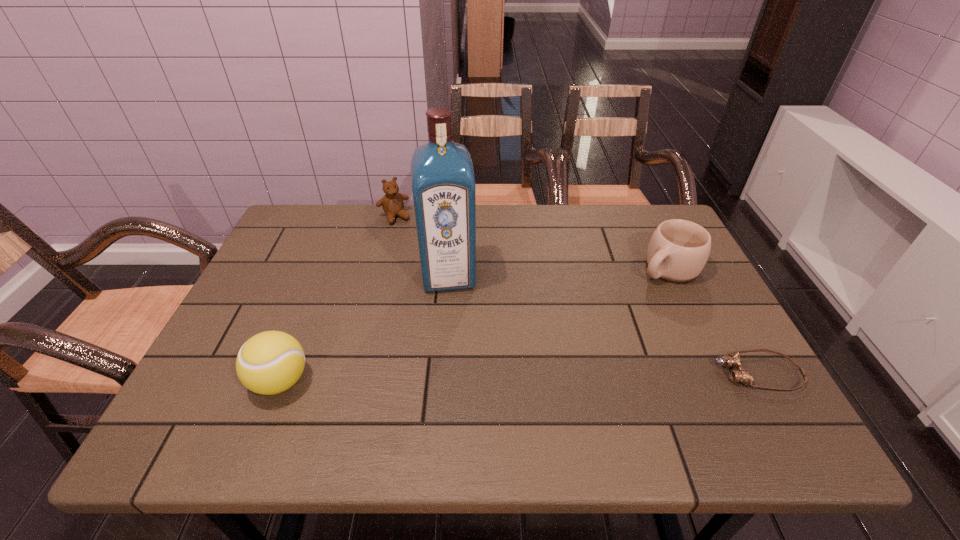
Find the location of a particular element. The height and width of the screenshot is (540, 960). free space at the far edge is located at coordinates (481, 208).

Where is `vacant space at the near edge of the desktop`? vacant space at the near edge of the desktop is located at coordinates (319, 381).

At what (x,y) coordinates should I click in order to perform the action: click on vacant area at the left edge. Please return your answer as a coordinate pair (x, y). Looking at the image, I should click on (280, 307).

Where is `free space at the right edge of the desktop`? free space at the right edge of the desktop is located at coordinates (692, 335).

The height and width of the screenshot is (540, 960). Find the location of `blank space at the far right corner of the desktop`. blank space at the far right corner of the desktop is located at coordinates (636, 249).

Locate an element on the screen. This screenshot has height=540, width=960. free space between the mug and the tennis ball is located at coordinates (474, 325).

Locate an element on the screen. The height and width of the screenshot is (540, 960). vacant region between the leftmost object and the teddy bear is located at coordinates [x=337, y=299].

Locate an element on the screen. free space between the third object from right to left and the leftmost object is located at coordinates click(365, 328).

In order to click on free area in between the mug and the tennis ball in this screenshot , I will do `click(474, 325)`.

You are a GUI agent. You are given a task and a screenshot of the screen. Output one action in this format:
    pyautogui.click(x=<x>, y=<y>)
    Task: Click on the free space between the leftmost object and the goggles
    
    Given the screenshot: What is the action you would take?
    pyautogui.click(x=519, y=377)